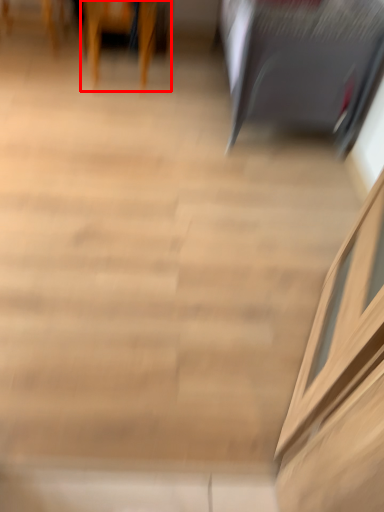
Question: From the image, what is the correct spatial relationship of furniture (annotated by the red box) in relation to furniture?

Choices:
 (A) left
 (B) right

Answer: (A)